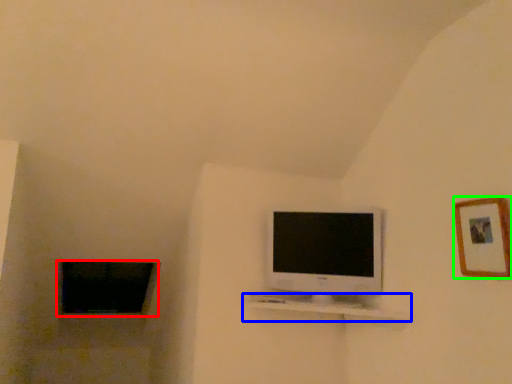
Question: Which is farther away from window (highlighted by a red box)? shelf (highlighted by a blue box) or picture frame (highlighted by a green box)?

Choices:
 (A) shelf
 (B) picture frame

Answer: (B)